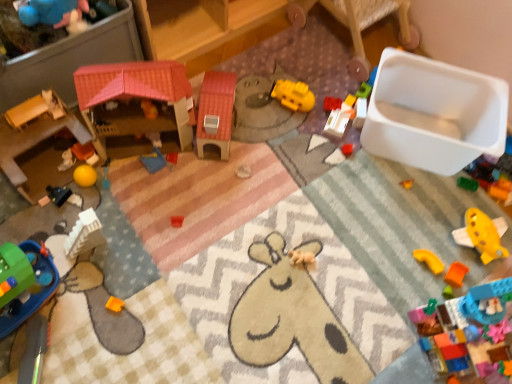
Identify the location of vacant space in white plastic container at upper right, which ranks as the 2th furniture in left-to-right order (from a real-world perspective). The image size is (512, 384). (336, 33).